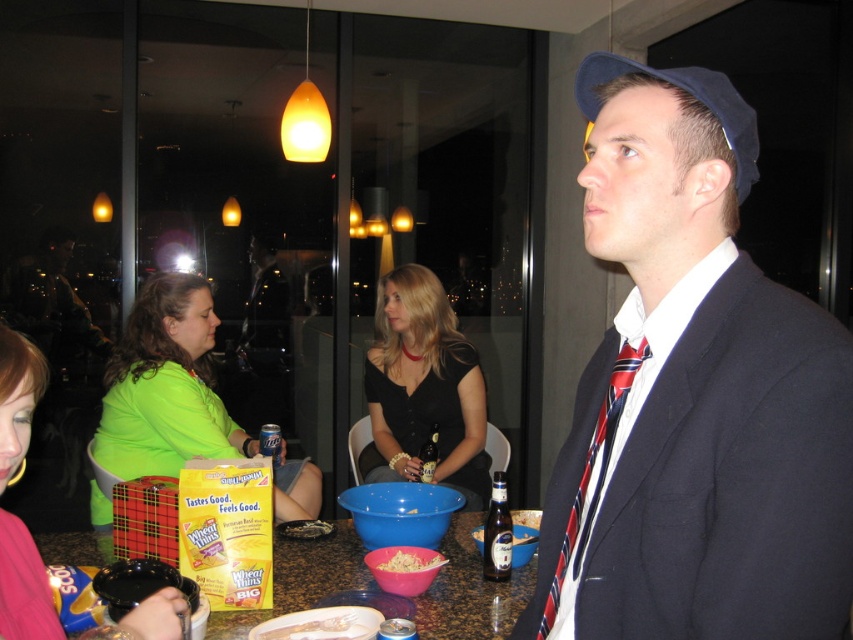
Is white creamy pasta at center to the left of shiny plastic bowl at center from the viewer's perspective?

Indeed, white creamy pasta at center is positioned on the left side of shiny plastic bowl at center.

Is point (347, 611) closer to viewer compared to point (389, 557)?

Yes, point (347, 611) is in front of point (389, 557).

Image resolution: width=853 pixels, height=640 pixels. Identify the location of white creamy pasta at center. (311, 627).

From the picture: Can you confirm if blue fabric hat at upper right is thinner than shiny plastic bowl at center?

Incorrect, blue fabric hat at upper right's width is not less than shiny plastic bowl at center's.

What do you see at coordinates (689, 93) in the screenshot? I see `blue fabric hat at upper right` at bounding box center [689, 93].

Does point (728, 128) come in front of point (427, 568)?

Yes, it is.

Locate an element on the screen. This screenshot has width=853, height=640. blue fabric hat at upper right is located at coordinates (689, 93).

Does black matte shirt at center appear under brown glass beer bottle at center?

No.

Is black matte shirt at center in front of brown glass beer bottle at center?

No, black matte shirt at center is further to the viewer.

The image size is (853, 640). What do you see at coordinates (424, 387) in the screenshot?
I see `black matte shirt at center` at bounding box center [424, 387].

The height and width of the screenshot is (640, 853). Find the location of `black matte shirt at center`. black matte shirt at center is located at coordinates (424, 387).